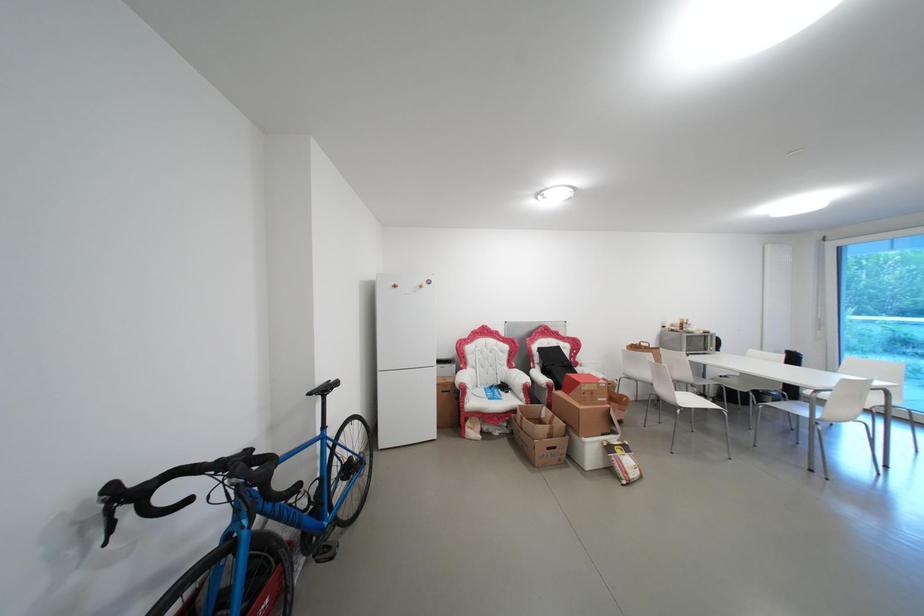
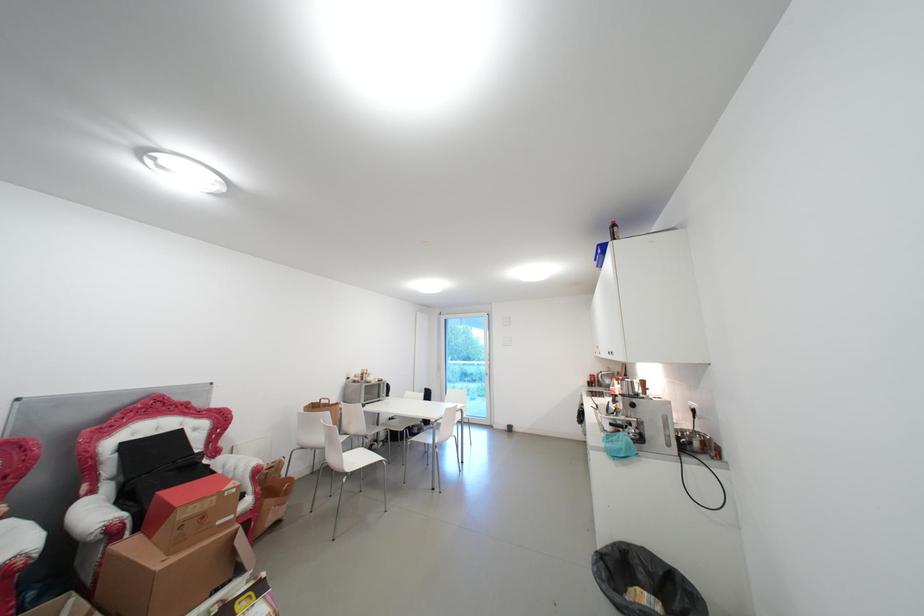
Question: Based on the continuous images, in which direction is the camera rotating? Reply with the corresponding letter.

Choices:
 (A) Left
 (B) Right
 (C) Up
 (D) Down

Answer: (B)